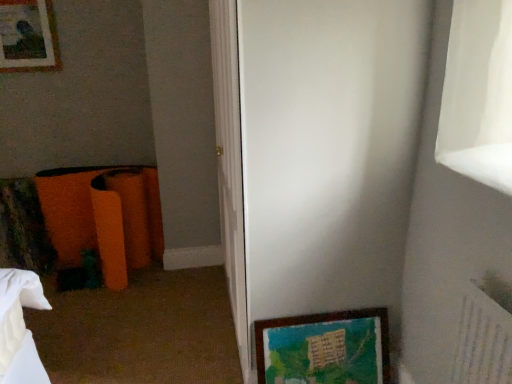
Question: Considering the relative sizes of matte wooden picture frame at upper left, the second picture frame positioned from the front, and white glossy screen door at center in the image provided, is matte wooden picture frame at upper left, the second picture frame positioned from the front, taller than white glossy screen door at center?

Choices:
 (A) no
 (B) yes

Answer: (A)

Question: Would you consider matte wooden picture frame at upper left, the second picture frame when ordered from right to left, to be distant from white glossy screen door at center?

Choices:
 (A) no
 (B) yes

Answer: (B)

Question: Does matte wooden picture frame at upper left, the second picture frame when ordered from right to left, appear on the right side of white glossy screen door at center?

Choices:
 (A) no
 (B) yes

Answer: (A)

Question: Is matte wooden picture frame at upper left, which ranks as the first picture frame in left-to-right order, at the left side of white glossy screen door at center?

Choices:
 (A) yes
 (B) no

Answer: (A)

Question: Can you confirm if matte wooden picture frame at upper left, the first picture frame viewed from the back, is smaller than white glossy screen door at center?

Choices:
 (A) no
 (B) yes

Answer: (B)

Question: From a real-world perspective, does matte wooden picture frame at upper left, acting as the 2th picture frame starting from the bottom, stand above white glossy screen door at center?

Choices:
 (A) yes
 (B) no

Answer: (A)

Question: Are wooden framed artwork at lower right, the 1th picture frame in the right-to-left sequence, and white glossy screen door at center far apart?

Choices:
 (A) no
 (B) yes

Answer: (A)

Question: Is wooden framed artwork at lower right, which appears as the first picture frame when ordered from the bottom, at the right side of white glossy screen door at center?

Choices:
 (A) yes
 (B) no

Answer: (A)

Question: From a real-world perspective, is wooden framed artwork at lower right, the 1th picture frame in the right-to-left sequence, over white glossy screen door at center?

Choices:
 (A) no
 (B) yes

Answer: (A)

Question: Is wooden framed artwork at lower right, which appears as the 2th picture frame when viewed from the top, oriented away from white glossy screen door at center?

Choices:
 (A) yes
 (B) no

Answer: (A)

Question: Is wooden framed artwork at lower right, positioned as the first picture frame in front-to-back order, to the left of white glossy screen door at center from the viewer's perspective?

Choices:
 (A) yes
 (B) no

Answer: (B)

Question: Can you confirm if wooden framed artwork at lower right, which appears as the second picture frame when viewed from the left, is bigger than white glossy screen door at center?

Choices:
 (A) no
 (B) yes

Answer: (A)

Question: Is white glossy screen door at center in front of wooden framed artwork at lower right, which appears as the first picture frame when ordered from the bottom?

Choices:
 (A) no
 (B) yes

Answer: (B)